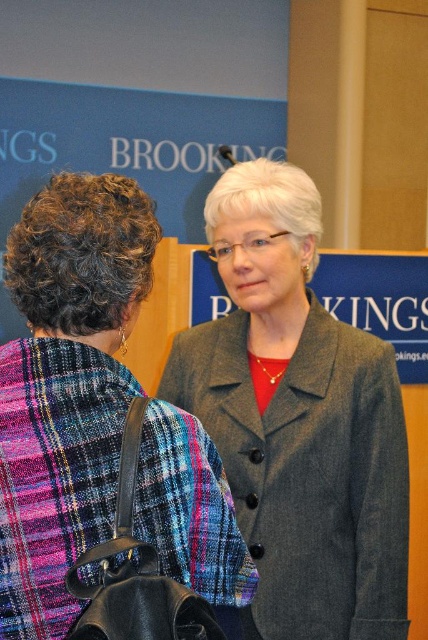
You are a photographer at the event and need to capture a closeup of the two individuals. The matte gray blazer at center and dark gray woolen coat at center are both in focus. Which clothing item is narrower in width?

The matte gray blazer at center is thinner than the dark gray woolen coat at center, so the matte gray blazer at center is narrower in width.

You are standing in the scene and want to move from point (x=82, y=397) to point (x=403, y=595). Which direction should you face to walk towards the second point?

Since point (x=82, y=397) is closer to the viewer than point (x=403, y=595), you should face away from the viewer to walk towards point (x=403, y=595).